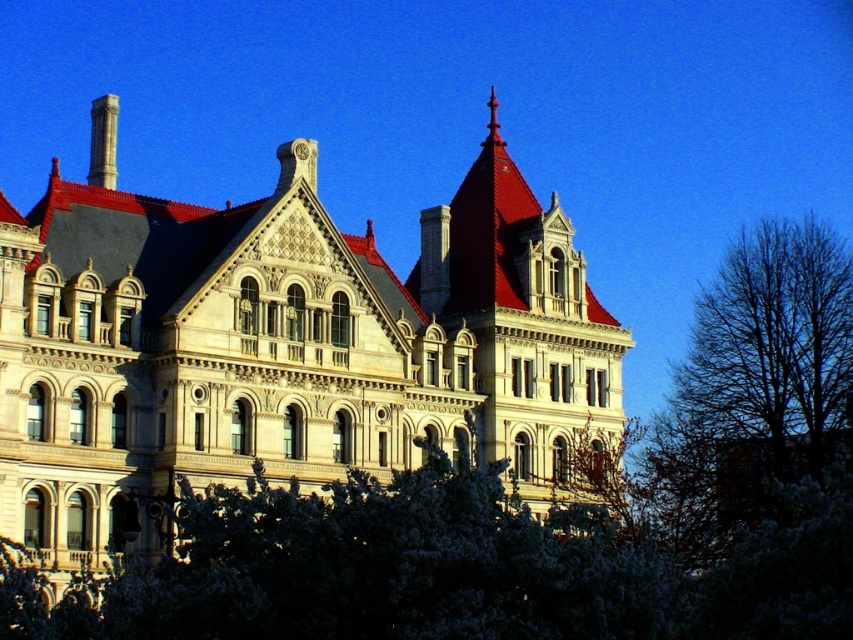
Can you confirm if stone building at center is positioned to the left of white textured leaves at center?

Yes, stone building at center is to the left of white textured leaves at center.

Is point (125, 408) positioned after point (199, 564)?

Yes, it is.

Who is more forward, (113, 116) or (520, 579)?

Point (520, 579) is more forward.

The image size is (853, 640). I want to click on stone building at center, so click(280, 346).

Is white textured leaves at center closer to camera compared to bare branches at right?

Yes, white textured leaves at center is closer to the viewer.

At what (x,y) coordinates should I click in order to perform the action: click on white textured leaves at center. Please return your answer as a coordinate pair (x, y). Looking at the image, I should click on click(x=456, y=568).

Can you confirm if stone building at center is positioned above bare branches at right?

Correct, stone building at center is located above bare branches at right.

From the picture: Between stone building at center and bare branches at right, which one is positioned higher?

Positioned higher is stone building at center.

The height and width of the screenshot is (640, 853). In order to click on stone building at center in this screenshot , I will do `click(280, 346)`.